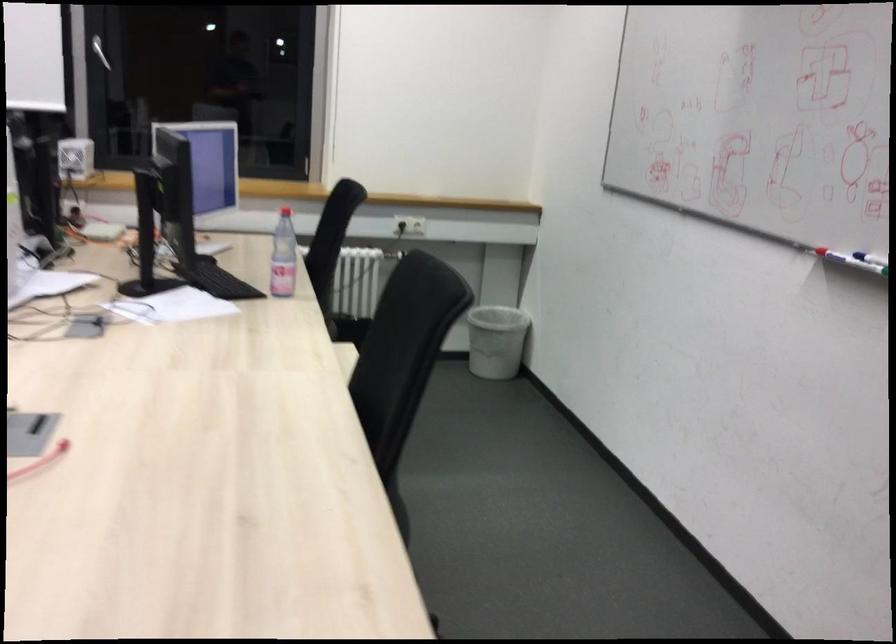
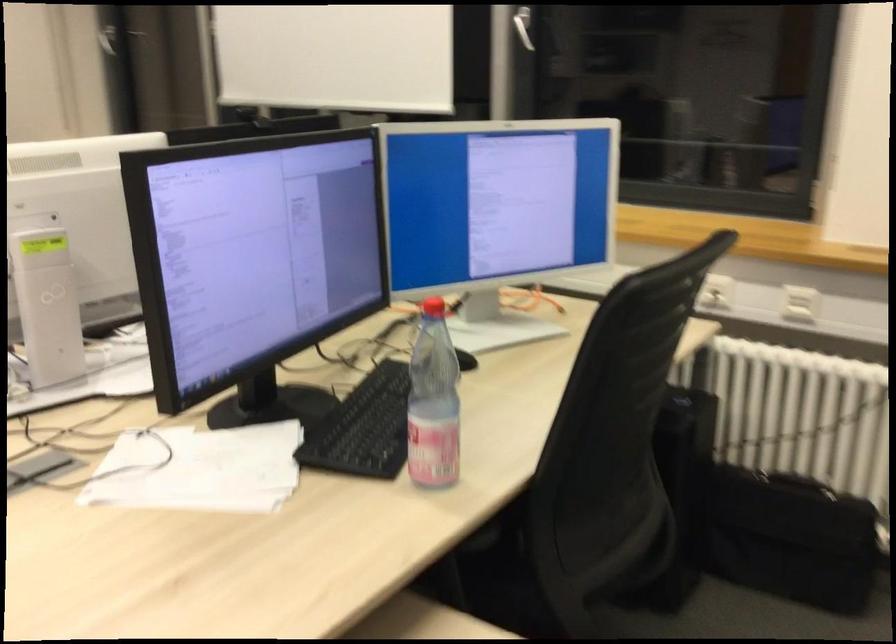
Where in the second image is the point corresponding to point (161, 310) from the first image?

(199, 469)